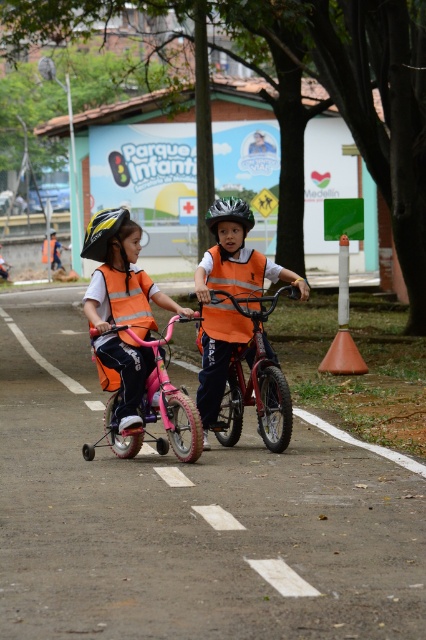
Question: Is pink matte bicycle at center bigger than yellow matte bicycle helmet at left?

Choices:
 (A) yes
 (B) no

Answer: (A)

Question: Does metallic red bicycle at center appear under pink matte bicycle at center?

Choices:
 (A) yes
 (B) no

Answer: (B)

Question: Which is nearer to the pink matte bicycle at center?

Choices:
 (A) metallic red bicycle at center
 (B) orange reflective safety vest at center
 (C) shiny silver helmet at center

Answer: (A)

Question: Estimate the real-world distances between objects in this image. Which object is closer to the pink matte bicycle at center?

Choices:
 (A) yellow matte bicycle helmet at left
 (B) metallic red bicycle at center

Answer: (B)

Question: Which of these objects is positioned closest to the shiny silver helmet at center?

Choices:
 (A) pink matte bicycle at center
 (B) orange reflective safety vest at center
 (C) metallic red bicycle at center

Answer: (B)

Question: Can you confirm if matte orange vest at center is positioned to the right of pink matte bicycle at center?

Choices:
 (A) yes
 (B) no

Answer: (B)